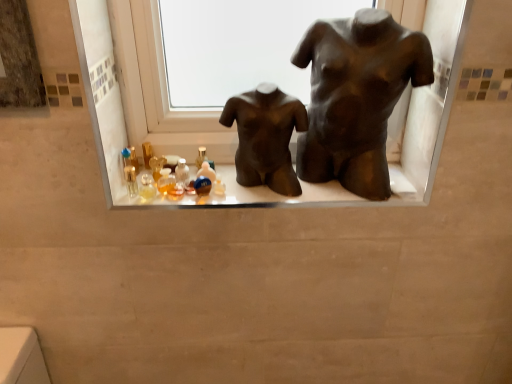
Question: Is matte black mannequins at center spatially inside bronze statue at center, the second statue (sculpture) from the right, or outside of it?

Choices:
 (A) outside
 (B) inside

Answer: (A)

Question: From the image's perspective, is matte black mannequins at center above or below bronze statue at center, the second statue (sculpture) from the right?

Choices:
 (A) above
 (B) below

Answer: (B)

Question: Considering the real-world distances, which object is closest to the matte black mannequins at center?

Choices:
 (A) bronze/statue at center, marked as the first statue (sculpture) in a right-to-left arrangement
 (B) bronze statue at center, the second statue (sculpture) from the right

Answer: (B)

Question: Based on their relative distances, which object is farther from the bronze statue at center, acting as the 1th statue (sculpture) starting from the left?

Choices:
 (A) bronze/statue at center, acting as the 2th statue (sculpture) starting from the left
 (B) matte black mannequins at center

Answer: (B)